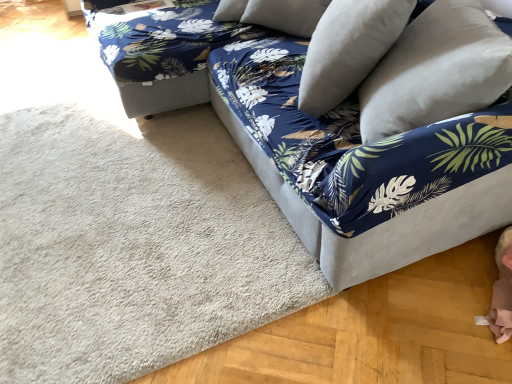
Question: Is the position of velvet blue couch at center more distant than that of beige carpet at lower left?

Choices:
 (A) yes
 (B) no

Answer: (B)

Question: From the image's perspective, would you say velvet blue couch at center is positioned over beige carpet at lower left?

Choices:
 (A) no
 (B) yes

Answer: (B)

Question: Are velvet blue couch at center and beige carpet at lower left making contact?

Choices:
 (A) no
 (B) yes

Answer: (A)

Question: Could you tell me if velvet blue couch at center is facing beige carpet at lower left?

Choices:
 (A) no
 (B) yes

Answer: (B)

Question: From the image's perspective, does velvet blue couch at center appear lower than beige carpet at lower left?

Choices:
 (A) yes
 (B) no

Answer: (B)

Question: Considering the positions of beige carpet at lower left and velvet blue couch at center in the image, is beige carpet at lower left bigger or smaller than velvet blue couch at center?

Choices:
 (A) small
 (B) big

Answer: (A)

Question: From the image's perspective, relative to velvet blue couch at center, is beige carpet at lower left above or below?

Choices:
 (A) below
 (B) above

Answer: (A)

Question: Does point (53, 107) appear closer or farther from the camera than point (181, 3)?

Choices:
 (A) closer
 (B) farther

Answer: (A)

Question: From a real-world perspective, is beige carpet at lower left above or below velvet blue couch at center?

Choices:
 (A) above
 (B) below

Answer: (B)

Question: From the image's perspective, is white soft pillow at upper right, the second pillow positioned from the right, above or below velvet blue couch at center?

Choices:
 (A) above
 (B) below

Answer: (A)

Question: Is white soft pillow at upper right, marked as the 1th pillow in a left-to-right arrangement, inside or outside of velvet blue couch at center?

Choices:
 (A) outside
 (B) inside

Answer: (B)

Question: From their relative heights in the image, would you say white soft pillow at upper right, marked as the 1th pillow in a left-to-right arrangement, is taller or shorter than velvet blue couch at center?

Choices:
 (A) tall
 (B) short

Answer: (B)

Question: In terms of width, does white soft pillow at upper right, the second pillow positioned from the right, look wider or thinner when compared to velvet blue couch at center?

Choices:
 (A) wide
 (B) thin

Answer: (B)

Question: In terms of height, does beige carpet at lower left look taller or shorter compared to white soft pillow at upper right, the second pillow positioned from the right?

Choices:
 (A) tall
 (B) short

Answer: (B)

Question: Choose the correct answer: Is beige carpet at lower left inside white soft pillow at upper right, the second pillow positioned from the right, or outside it?

Choices:
 (A) inside
 (B) outside

Answer: (B)